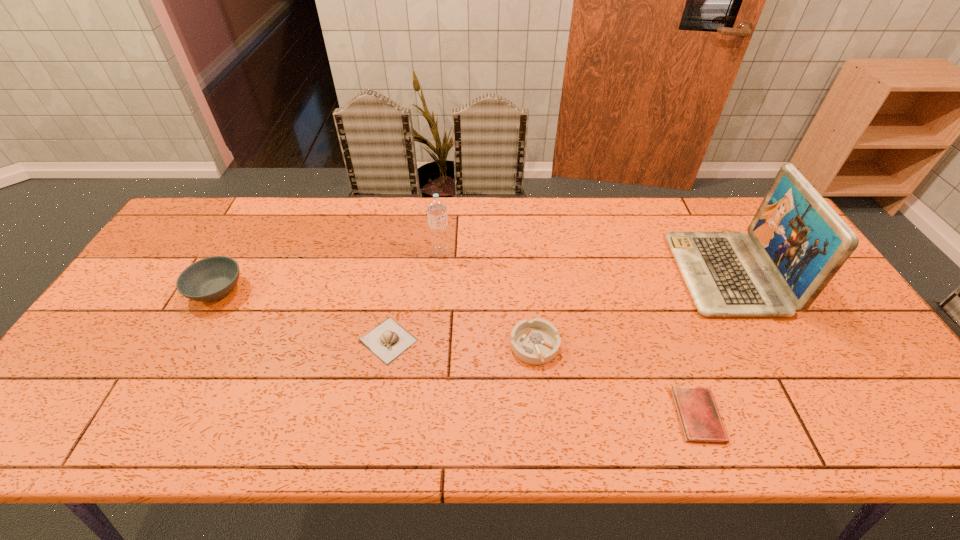
The height and width of the screenshot is (540, 960). I want to click on laptop computer, so click(803, 241).

Locate an element on the screen. The image size is (960, 540). the tallest object is located at coordinates (803, 241).

Where is `the second tallest object`? Image resolution: width=960 pixels, height=540 pixels. the second tallest object is located at coordinates (436, 208).

I want to click on water bottle, so click(x=436, y=208).

Where is `the third tallest object`? This screenshot has height=540, width=960. the third tallest object is located at coordinates 210,279.

Identify the location of soup bowl. The height and width of the screenshot is (540, 960). (210, 279).

Where is `ashtray`? Image resolution: width=960 pixels, height=540 pixels. ashtray is located at coordinates (536, 341).

You are a GUI agent. You are given a task and a screenshot of the screen. Output one action in this format:
    pyautogui.click(x=<x>, y=<y>)
    Task: Click on the third shortest object
    The width and height of the screenshot is (960, 540).
    Given the screenshot: What is the action you would take?
    pyautogui.click(x=536, y=341)

What are the coordinates of `garlic` in the screenshot? It's located at (388, 340).

The height and width of the screenshot is (540, 960). I want to click on the second object from left to right, so click(x=388, y=340).